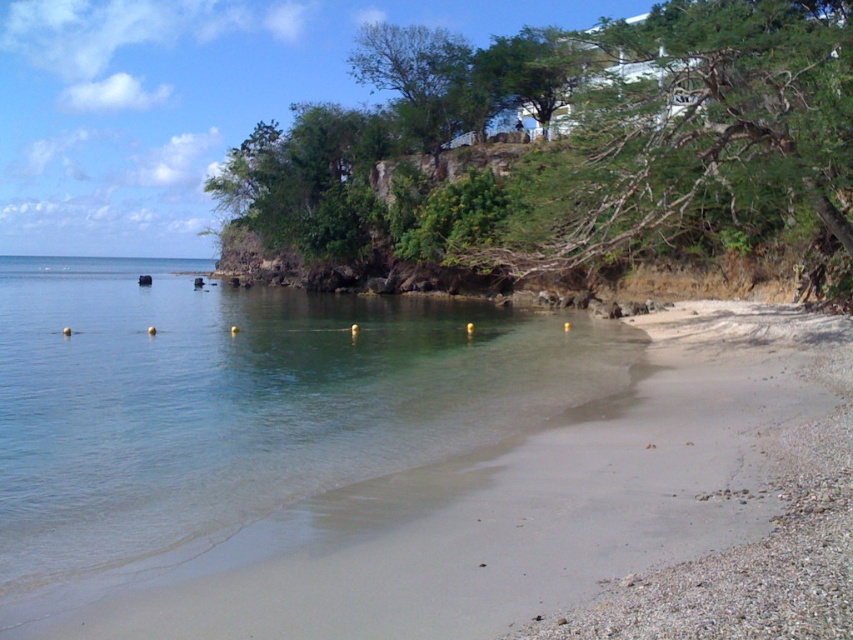
Who is lower down, clear water at lower left or green leafy tree at upper center?

clear water at lower left

Is point (12, 557) positioned behind point (664, 129)?

No, it is not.

Measure the distance between clear water at lower left and camera.

The distance of clear water at lower left from camera is 6.88 meters.

The height and width of the screenshot is (640, 853). I want to click on clear water at lower left, so click(x=247, y=416).